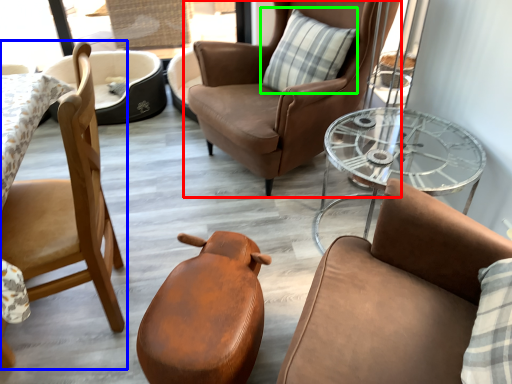
Question: Considering the real-world distances, which object is farthest from chair (highlighted by a red box)? chair (highlighted by a blue box) or pillow (highlighted by a green box)?

Choices:
 (A) chair
 (B) pillow

Answer: (A)